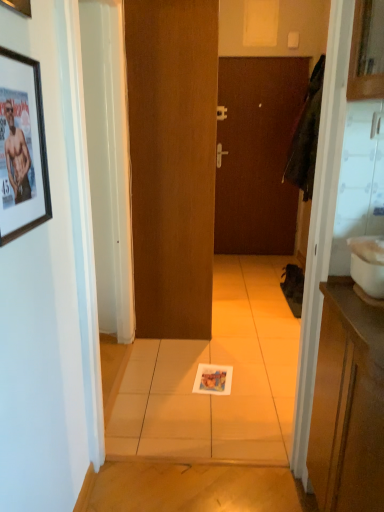
What do you see at coordinates (257, 154) in the screenshot? The width and height of the screenshot is (384, 512). I see `brown matte door at center, the first door positioned from the right` at bounding box center [257, 154].

Identify the location of brown matte door at center, positioned as the second door in left-to-right order. This screenshot has height=512, width=384. (257, 154).

Locate an element on the screen. The width and height of the screenshot is (384, 512). white glossy sink at right is located at coordinates (368, 264).

Find the location of a particular element. The height and width of the screenshot is (512, 384). brown matte door at center, the first door positioned from the front is located at coordinates (172, 162).

Looking at this image, in terms of height, does brushed metal picture frame at upper left, which is counted as the second picture frame, starting from the bottom, look taller or shorter compared to white glossy sink at right?

In the image, brushed metal picture frame at upper left, which is counted as the second picture frame, starting from the bottom, appears to be taller than white glossy sink at right.

Could white glossy sink at right be considered to be inside brushed metal picture frame at upper left, which appears as the first picture frame when viewed from the top?

Definitely not — white glossy sink at right is not inside brushed metal picture frame at upper left, which appears as the first picture frame when viewed from the top.

Find the location of a particular element. The width and height of the screenshot is (384, 512). the 2nd picture frame in front when counting from the white glossy sink at right is located at coordinates (18, 6).

Is the position of brown matte door at center, the 1th door from the left, less distant than that of brown matte door at center, positioned as the second door in left-to-right order?

Yes, it is in front of brown matte door at center, positioned as the second door in left-to-right order.

Is brown matte door at center, the 1th door from the left, oriented towards brown matte door at center, positioned as the second door in left-to-right order?

No, brown matte door at center, the 1th door from the left, is not facing towards brown matte door at center, positioned as the second door in left-to-right order.

Which object is positioned more to the right, brown matte door at center, which is counted as the second door, starting from the right, or brown matte door at center, positioned as the second door in left-to-right order?

brown matte door at center, positioned as the second door in left-to-right order.

In order to click on door to the right of brown matte door at center, which is counted as the second door, starting from the right in this screenshot , I will do `click(257, 154)`.

From the image's perspective, is matte black picture frame at upper left, which is the 2th picture frame from top to bottom, on brown matte door at center, which is counted as the second door, starting from the right?

Incorrect, from the image's perspective, matte black picture frame at upper left, which is the 2th picture frame from top to bottom, is lower than brown matte door at center, which is counted as the second door, starting from the right.

How far apart are matte black picture frame at upper left, the 1th picture frame from the bottom, and brown matte door at center, the first door positioned from the front?

A distance of 5.01 feet exists between matte black picture frame at upper left, the 1th picture frame from the bottom, and brown matte door at center, the first door positioned from the front.

Looking at this image, from a real-world perspective, which is physically above, matte black picture frame at upper left, which is the 2th picture frame from top to bottom, or brown matte door at center, the 2th door viewed from the back?

matte black picture frame at upper left, which is the 2th picture frame from top to bottom, from a real-world perspective.

Does matte black picture frame at upper left, which is the 2th picture frame from top to bottom, have a lesser width compared to brown matte door at center, the 2th door viewed from the back?

Indeed, matte black picture frame at upper left, which is the 2th picture frame from top to bottom, has a lesser width compared to brown matte door at center, the 2th door viewed from the back.

Based on the photo, is white glossy sink at right looking in the opposite direction of brown matte door at center, which is counted as the second door, starting from the right?

Absolutely, white glossy sink at right is directed away from brown matte door at center, which is counted as the second door, starting from the right.

Could brown matte door at center, which is counted as the second door, starting from the right, be considered to be inside white glossy sink at right?

No, white glossy sink at right does not contain brown matte door at center, which is counted as the second door, starting from the right.

Which point is more distant from viewer, (361, 265) or (209, 320)?

The point (209, 320) is behind.

How much distance is there between white glossy sink at right and brown matte door at center, the 1th door from the left?

They are 1.53 meters apart.

Is brown matte door at center, positioned as the second door in left-to-right order, bigger than brown matte door at center, the first door positioned from the front?

Yes, brown matte door at center, positioned as the second door in left-to-right order, is bigger than brown matte door at center, the first door positioned from the front.

Considering the relative sizes of brown matte door at center, which is the 2th door in front-to-back order, and brown matte door at center, the first door positioned from the front, in the image provided, is brown matte door at center, which is the 2th door in front-to-back order, wider than brown matte door at center, the first door positioned from the front,?

Correct, the width of brown matte door at center, which is the 2th door in front-to-back order, exceeds that of brown matte door at center, the first door positioned from the front.

Does brown matte door at center, the first door positioned from the right, have a lesser height compared to brown matte door at center, which is counted as the second door, starting from the right?

Yes, brown matte door at center, the first door positioned from the right, is shorter than brown matte door at center, which is counted as the second door, starting from the right.

Does brushed metal picture frame at upper left, which appears as the first picture frame when viewed from the top, have a lesser width compared to matte black picture frame at upper left, the 1th picture frame from the bottom?

Incorrect, the width of brushed metal picture frame at upper left, which appears as the first picture frame when viewed from the top, is not less than that of matte black picture frame at upper left, the 1th picture frame from the bottom.

In the scene shown: From the image's perspective, which is below, brushed metal picture frame at upper left, which appears as the first picture frame when viewed from the top, or matte black picture frame at upper left, which is the 2th picture frame from top to bottom?

matte black picture frame at upper left, which is the 2th picture frame from top to bottom, is shown below in the image.

Could you tell me if brushed metal picture frame at upper left, which is counted as the second picture frame, starting from the bottom, is facing matte black picture frame at upper left, which is the 2th picture frame from top to bottom?

No.

Is point (32, 216) closer or farther from the camera than point (24, 6)?

Point (32, 216).

How different are the orientations of matte black picture frame at upper left, the 1th picture frame from the bottom, and brushed metal picture frame at upper left, which appears as the first picture frame when viewed from the top, in degrees?

The facing directions of matte black picture frame at upper left, the 1th picture frame from the bottom, and brushed metal picture frame at upper left, which appears as the first picture frame when viewed from the top, are 0.00579 degrees apart.

From a real-world perspective, which object stands above the other?

From a 3D spatial view, brushed metal picture frame at upper left, which is counted as the second picture frame, starting from the bottom, is above.

From the image's perspective, is matte black picture frame at upper left, the 1th picture frame from the bottom, positioned above or below brushed metal picture frame at upper left, which is counted as the second picture frame, starting from the bottom?

Based on their image positions, matte black picture frame at upper left, the 1th picture frame from the bottom, is located beneath brushed metal picture frame at upper left, which is counted as the second picture frame, starting from the bottom.

Starting from the white glossy sink at right, which picture frame is the 2nd one in front? Please provide its 2D coordinates.

[(18, 6)]

Locate an element on the screen. door behind the brown matte door at center, the first door positioned from the front is located at coordinates (257, 154).

From the image, which object appears to be nearer to brushed metal picture frame at upper left, which appears as the first picture frame when viewed from the top, brown matte door at center, the first door positioned from the front, or matte black picture frame at upper left, which is the 2th picture frame from top to bottom?

matte black picture frame at upper left, which is the 2th picture frame from top to bottom, is closer to brushed metal picture frame at upper left, which appears as the first picture frame when viewed from the top.

From the image, which object appears to be nearer to brushed metal picture frame at upper left, which is counted as the second picture frame, starting from the bottom, matte black picture frame at upper left, which is the 2th picture frame from top to bottom, or matte paper magazine at center?

matte black picture frame at upper left, which is the 2th picture frame from top to bottom, lies closer to brushed metal picture frame at upper left, which is counted as the second picture frame, starting from the bottom, than the other object.

Looking at the image, which one is located further to brown matte door at center, positioned as the second door in left-to-right order, matte black picture frame at upper left, which is the 2th picture frame from top to bottom, or white glossy sink at right?

matte black picture frame at upper left, which is the 2th picture frame from top to bottom.

Looking at the image, which one is located closer to white glossy sink at right, brushed metal picture frame at upper left, which appears as the first picture frame when viewed from the top, or brown matte door at center, the first door positioned from the right?

brushed metal picture frame at upper left, which appears as the first picture frame when viewed from the top, is positioned closer to the anchor white glossy sink at right.

In the scene shown: Considering their positions, is matte paper magazine at center positioned closer to matte black picture frame at upper left, the 1th picture frame from the bottom, than brushed metal picture frame at upper left, which appears as the first picture frame when viewed from the top?

brushed metal picture frame at upper left, which appears as the first picture frame when viewed from the top, is closer to matte black picture frame at upper left, the 1th picture frame from the bottom.

From the image, which object appears to be farther from matte paper magazine at center, brown matte door at center, positioned as the second door in left-to-right order, or matte black picture frame at upper left, which is the 2th picture frame from top to bottom?

brown matte door at center, positioned as the second door in left-to-right order, is positioned further to the anchor matte paper magazine at center.

Which object lies further to the anchor point brown matte door at center, the 1th door from the left, brown matte door at center, which is the 2th door in front-to-back order, or white glossy sink at right?

Based on the image, brown matte door at center, which is the 2th door in front-to-back order, appears to be further to brown matte door at center, the 1th door from the left.

When comparing their distances from brushed metal picture frame at upper left, which appears as the first picture frame when viewed from the top, does brown matte door at center, which is the 2th door in front-to-back order, or matte black picture frame at upper left, the 1th picture frame from the bottom, seem closer?

matte black picture frame at upper left, the 1th picture frame from the bottom, lies closer to brushed metal picture frame at upper left, which appears as the first picture frame when viewed from the top, than the other object.

Where is `sink positioned between matte black picture frame at upper left, which is the 2th picture frame from top to bottom, and brown matte door at center, the first door positioned from the right, from near to far`? The height and width of the screenshot is (512, 384). sink positioned between matte black picture frame at upper left, which is the 2th picture frame from top to bottom, and brown matte door at center, the first door positioned from the right, from near to far is located at coordinates (368, 264).

Locate an element on the screen. picture frame positioned between brushed metal picture frame at upper left, which is counted as the second picture frame, starting from the bottom, and matte paper magazine at center from near to far is located at coordinates (22, 148).

The image size is (384, 512). In order to click on magazine between white glossy sink at right and brown matte door at center, positioned as the second door in left-to-right order, along the z-axis in this screenshot , I will do `click(213, 379)`.

The image size is (384, 512). I want to click on magazine between brown matte door at center, which is counted as the second door, starting from the right, and brown matte door at center, the first door positioned from the right, from front to back, so click(213, 379).